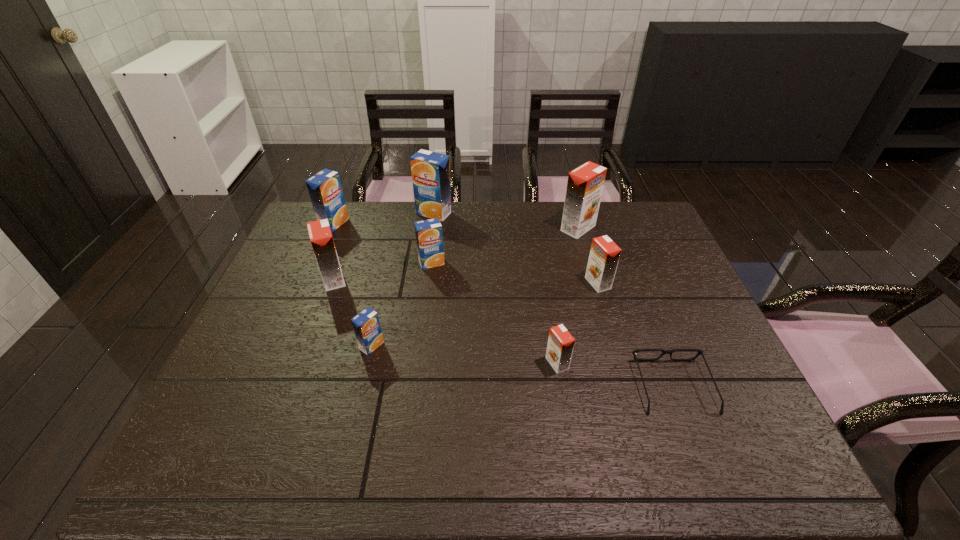
At what (x,y) coordinates should I click in order to perform the action: click on vacant space located on the front-facing side of the spectacles. Please return your answer as a coordinate pair (x, y). The height and width of the screenshot is (540, 960). Looking at the image, I should click on (639, 296).

I want to click on free space located 0.330m on the front-facing side of the spectacles, so coord(630,271).

Image resolution: width=960 pixels, height=540 pixels. Identify the location of object that is at the right edge. (663, 351).

The image size is (960, 540). In order to click on object that is at the far left corner in this screenshot , I will do `click(325, 190)`.

Where is `free location at the far edge of the desktop`? free location at the far edge of the desktop is located at coordinates (408, 236).

Find the location of a particular element. blank area at the near edge is located at coordinates (601, 454).

Identify the location of free space at the left edge of the desktop. The width and height of the screenshot is (960, 540). (230, 373).

This screenshot has height=540, width=960. In order to click on vacant space at the right edge in this screenshot , I will do `click(681, 333)`.

This screenshot has height=540, width=960. Find the location of `vacant space at the near right corner of the desktop`. vacant space at the near right corner of the desktop is located at coordinates (760, 469).

I want to click on free space between the shortest object and the farthest orange orange juice, so click(x=626, y=307).